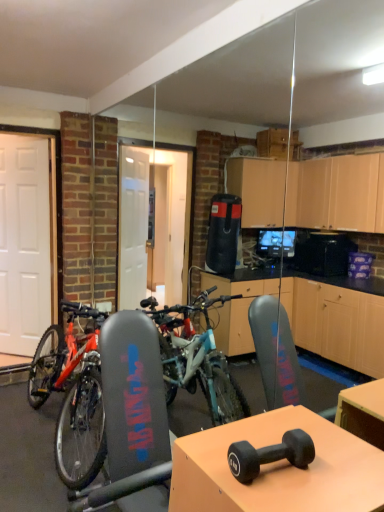
This screenshot has width=384, height=512. What are the coordinates of `vacant area on top of matte black dumbbell at center (from a real-world perspective)` in the screenshot? It's located at (274, 463).